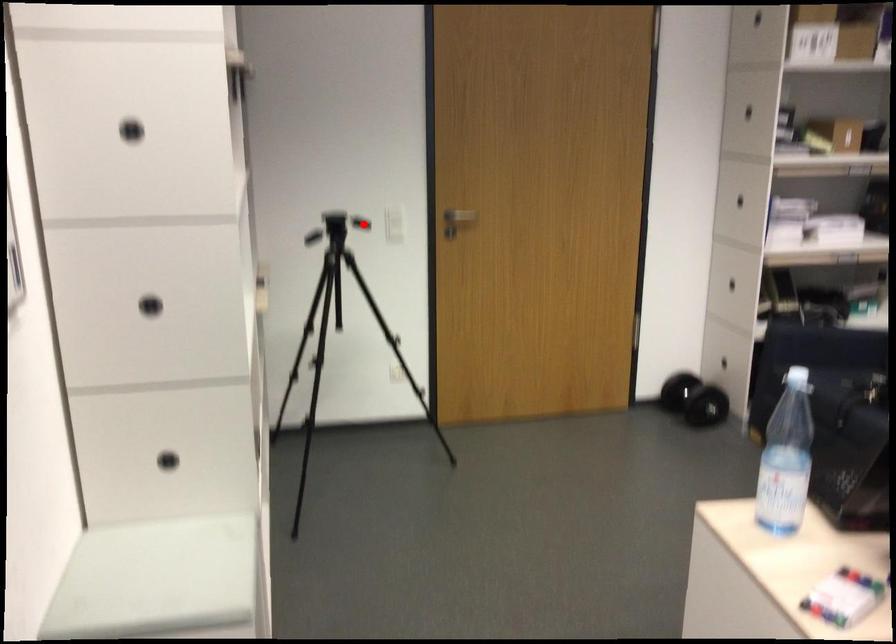
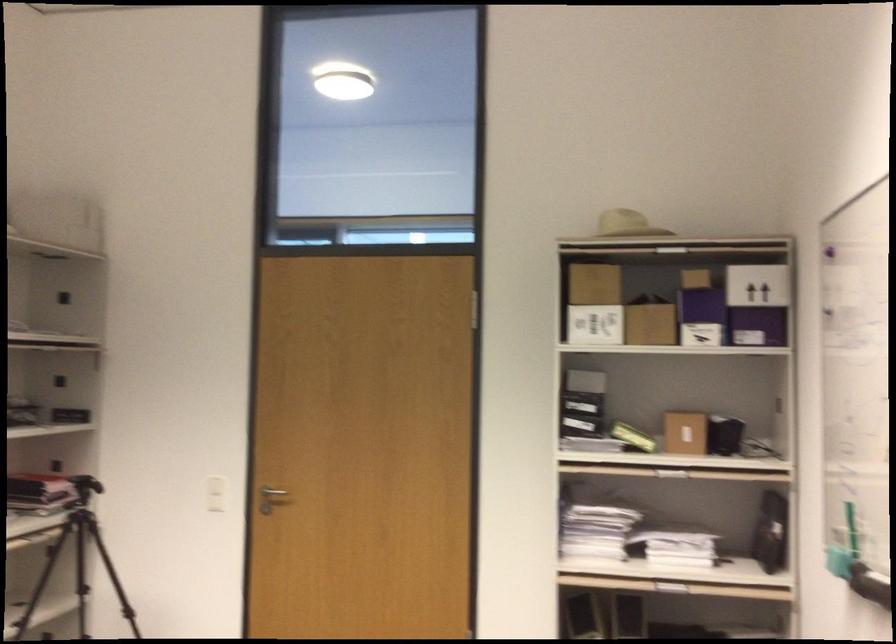
Locate, in the second image, the point that corresponds to the highlighted location in the first image.

(216, 494)